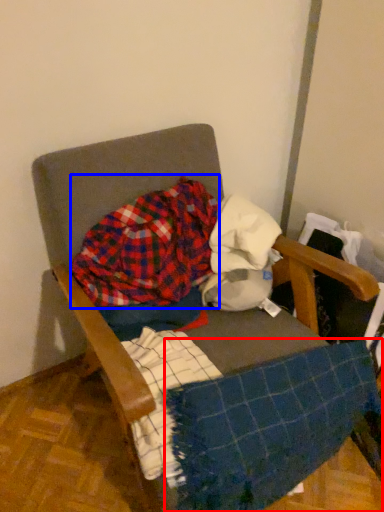
Question: Which of the following is the farthest to the observer, blanket (highlighted by a red box) or flannel (highlighted by a blue box)?

Choices:
 (A) blanket
 (B) flannel

Answer: (B)